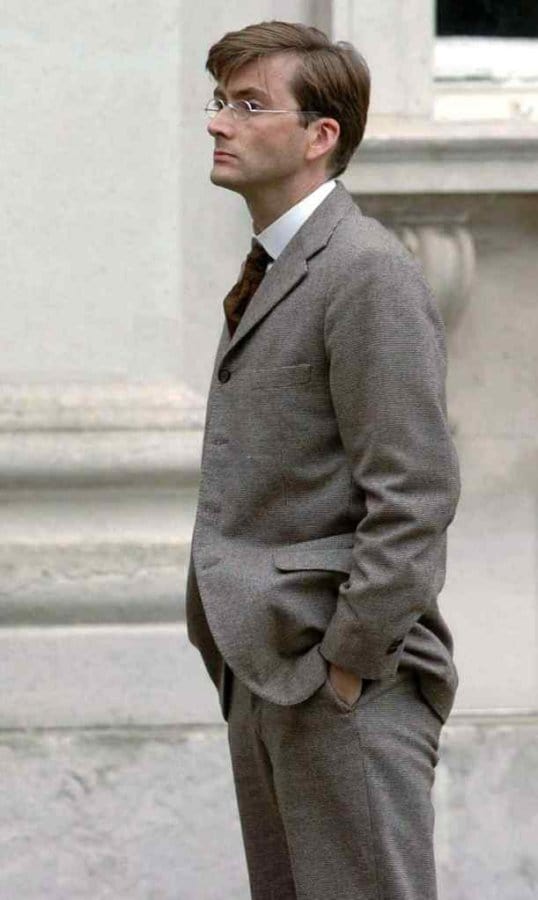
I want to click on window, so tap(494, 49).